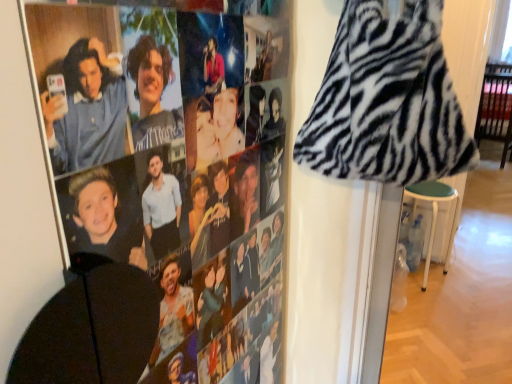
Describe the element at coordinates (387, 101) in the screenshot. Image resolution: width=512 pixels, height=384 pixels. I see `zebra print fabric at upper right` at that location.

The height and width of the screenshot is (384, 512). I want to click on green fabric stool at lower right, so click(434, 214).

Where is `zebra print fabric at upper right`? zebra print fabric at upper right is located at coordinates (387, 101).

From a real-world perspective, is zebra print hoodie at upper left over green fabric stool at lower right?

Indeed, from a real-world perspective, zebra print hoodie at upper left stands above green fabric stool at lower right.

Based on the photo, which is farther from the camera, (241,270) or (435,209)?

The point (435,209) is farther from the camera.

Is zebra print hoodie at upper left looking in the opposite direction of green fabric stool at lower right?

That's not correct — zebra print hoodie at upper left is not looking away from green fabric stool at lower right.

Can you confirm if zebra print hoodie at upper left is wider than zebra print fabric at upper right?

No, zebra print hoodie at upper left is not wider than zebra print fabric at upper right.

From a real-world perspective, is zebra print hoodie at upper left below zebra print fabric at upper right?

Correct, in the physical world, zebra print hoodie at upper left is lower than zebra print fabric at upper right.

From the picture: Between zebra print hoodie at upper left and zebra print fabric at upper right, which one has less height?

zebra print fabric at upper right is shorter.

From the image's perspective, would you say zebra print hoodie at upper left is shown under zebra print fabric at upper right?

Yes, from the image's perspective, zebra print hoodie at upper left is beneath zebra print fabric at upper right.

From a real-world perspective, which object rests below the other?

In real-world perspective, green fabric stool at lower right is lower.

Would you say green fabric stool at lower right contains zebra print fabric at upper right?

No, zebra print fabric at upper right is not a part of green fabric stool at lower right.

Considering the sizes of objects green fabric stool at lower right and zebra print fabric at upper right in the image provided, who is thinner, green fabric stool at lower right or zebra print fabric at upper right?

With smaller width is zebra print fabric at upper right.

In the scene shown: Considering the relative positions of green fabric stool at lower right and zebra print fabric at upper right in the image provided, is green fabric stool at lower right to the right of zebra print fabric at upper right from the viewer's perspective?

Correct, you'll find green fabric stool at lower right to the right of zebra print fabric at upper right.

Is zebra print fabric at upper right inside the boundaries of zebra print hoodie at upper left, or outside?

zebra print fabric at upper right is outside zebra print hoodie at upper left.

Is zebra print fabric at upper right with zebra print hoodie at upper left?

zebra print fabric at upper right and zebra print hoodie at upper left are not in contact.

Is zebra print fabric at upper right taller or shorter than zebra print hoodie at upper left?

In the image, zebra print fabric at upper right appears to be shorter than zebra print hoodie at upper left.

Is green fabric stool at lower right completely or partially inside zebra print fabric at upper right?

That's incorrect, green fabric stool at lower right is not inside zebra print fabric at upper right.

From a real-world perspective, is zebra print fabric at upper right positioned over green fabric stool at lower right based on gravity?

Yes, from a real-world perspective, zebra print fabric at upper right is over green fabric stool at lower right

Considering the relative sizes of zebra print fabric at upper right and green fabric stool at lower right in the image provided, is zebra print fabric at upper right taller than green fabric stool at lower right?

Incorrect, the height of zebra print fabric at upper right is not larger of that of green fabric stool at lower right.

Is point (394, 30) closer or farther from the camera than point (432, 241)?

Point (394, 30) is closer to the camera than point (432, 241).

From the image's perspective, is green fabric stool at lower right located above or below zebra print hoodie at upper left?

Based on their image positions, green fabric stool at lower right is located beneath zebra print hoodie at upper left.

In the scene shown: Would you say green fabric stool at lower right is outside zebra print hoodie at upper left?

green fabric stool at lower right is positioned outside zebra print hoodie at upper left.

Could you tell me if green fabric stool at lower right is facing zebra print hoodie at upper left?

Yes, green fabric stool at lower right faces towards zebra print hoodie at upper left.

Which object is thinner, green fabric stool at lower right or zebra print hoodie at upper left?

zebra print hoodie at upper left is thinner.

Find the location of a particular element. The height and width of the screenshot is (384, 512). bar stool located behind the zebra print hoodie at upper left is located at coordinates (434, 214).

Where is `person in front of the zebra print fabric at upper right`? person in front of the zebra print fabric at upper right is located at coordinates (194, 253).

Based on their spatial positions, is zebra print fabric at upper right or green fabric stool at lower right closer to zebra print hoodie at upper left?

Based on the image, zebra print fabric at upper right appears to be nearer to zebra print hoodie at upper left.

Based on their spatial positions, is zebra print hoodie at upper left or green fabric stool at lower right closer to zebra print fabric at upper right?

zebra print hoodie at upper left is closer to zebra print fabric at upper right.

When comparing their distances from zebra print hoodie at upper left, does green fabric stool at lower right or zebra print fabric at upper right seem closer?

The object closer to zebra print hoodie at upper left is zebra print fabric at upper right.

Based on their spatial positions, is zebra print fabric at upper right or zebra print hoodie at upper left closer to green fabric stool at lower right?

Based on the image, zebra print fabric at upper right appears to be nearer to green fabric stool at lower right.

In the scene shown: Looking at the image, which one is located closer to green fabric stool at lower right, zebra print hoodie at upper left or zebra print fabric at upper right?

zebra print fabric at upper right lies closer to green fabric stool at lower right than the other object.

Looking at the image, which one is located further to zebra print fabric at upper right, green fabric stool at lower right or zebra print hoodie at upper left?

The object further to zebra print fabric at upper right is green fabric stool at lower right.

The width and height of the screenshot is (512, 384). Find the location of `blanket between zebra print hoodie at upper left and green fabric stool at lower right from front to back`. blanket between zebra print hoodie at upper left and green fabric stool at lower right from front to back is located at coordinates (387, 101).